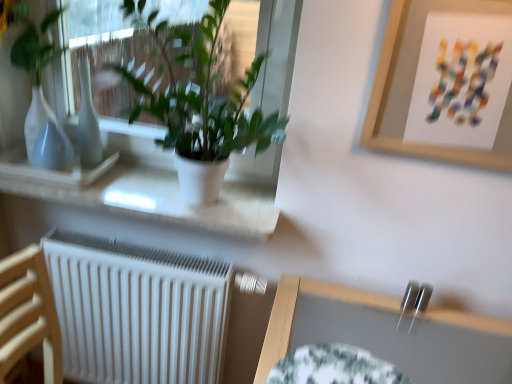
The width and height of the screenshot is (512, 384). In order to click on vacant area that lies in front of white glossy vase at upper left, the first vase when ordered from right to left in this screenshot , I will do `click(89, 184)`.